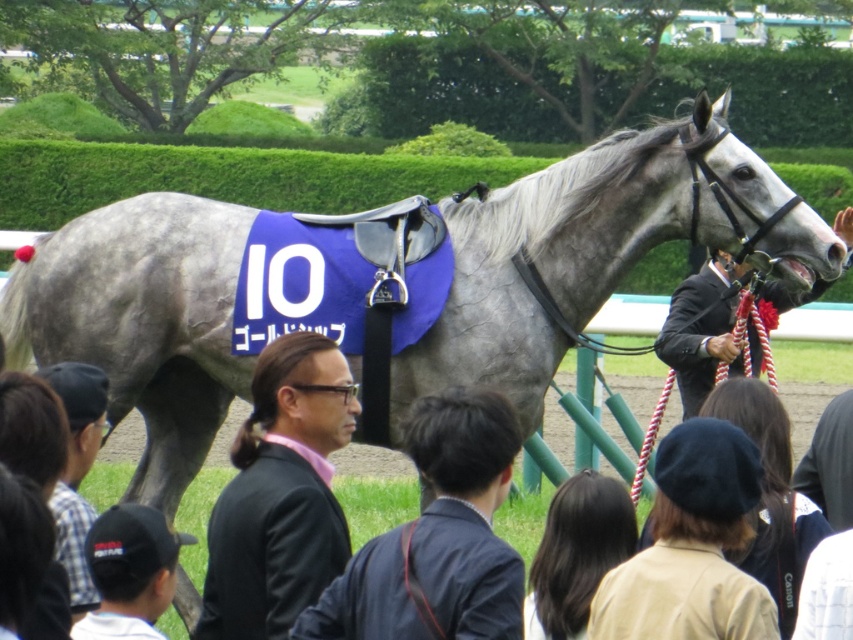
Question: Which object appears farthest from the camera in this image?

Choices:
 (A) black matte suit at center
 (B) dark gray suit at center
 (C) plaid shirt at lower left

Answer: (A)

Question: Is plaid shirt at lower left smaller than black suit at center?

Choices:
 (A) no
 (B) yes

Answer: (B)

Question: Is dark gray suit at center positioned at the back of plaid shirt at lower left?

Choices:
 (A) no
 (B) yes

Answer: (A)

Question: Which point is farther to the camera?

Choices:
 (A) dark gray suit at center
 (B) plaid shirt at lower left
 (C) black suit at center
 (D) black matte suit at center

Answer: (C)

Question: Is black matte suit at center wider than dark gray suit at center?

Choices:
 (A) yes
 (B) no

Answer: (B)

Question: Which object is closer to the camera taking this photo?

Choices:
 (A) black matte suit at center
 (B) dark gray suit at center

Answer: (B)